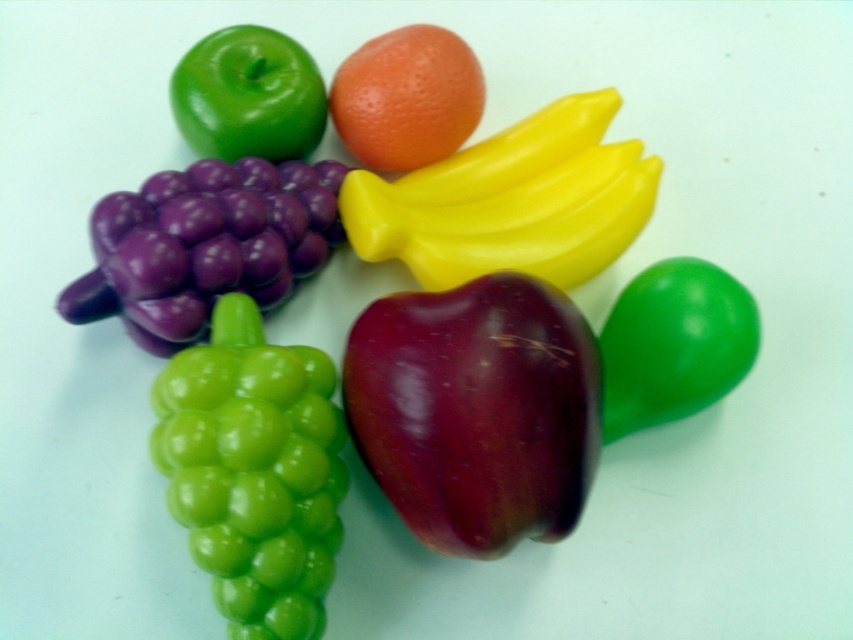
Question: Which point is farther to the camera?

Choices:
 (A) (227, 241)
 (B) (636, 195)

Answer: (B)

Question: Is shiny dark red apple at center to the right of purple glossy grapes at left from the viewer's perspective?

Choices:
 (A) no
 (B) yes

Answer: (B)

Question: Is green rubbery grape at lower left to the right of yellow matte bananas at upper center from the viewer's perspective?

Choices:
 (A) yes
 (B) no

Answer: (B)

Question: Estimate the real-world distances between objects in this image. Which object is closer to the orange matte at center?

Choices:
 (A) shiny dark red apple at center
 (B) green matte pepper at lower right
 (C) yellow matte bananas at upper center
 (D) green rubbery grape at lower left

Answer: (C)

Question: Which of the following is the closest to the observer?

Choices:
 (A) glossy green apple at upper left
 (B) orange matte at center
 (C) shiny dark red apple at center

Answer: (C)

Question: Can you confirm if shiny dark red apple at center is bigger than glossy green apple at upper left?

Choices:
 (A) no
 (B) yes

Answer: (B)